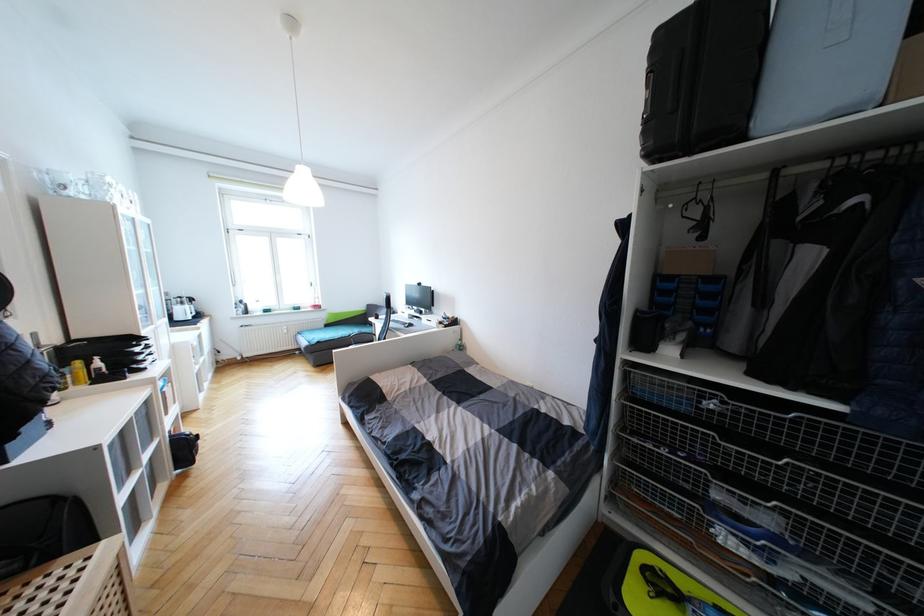
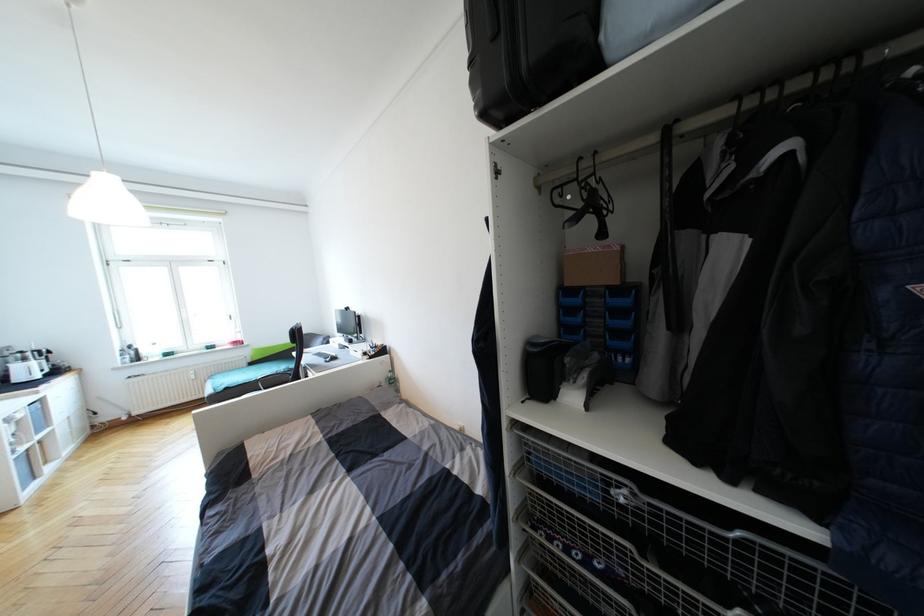
Question: Based on the continuous images, in which direction is the camera rotating? Reply with the corresponding letter.

Choices:
 (A) Left
 (B) Right
 (C) Up
 (D) Down

Answer: (B)